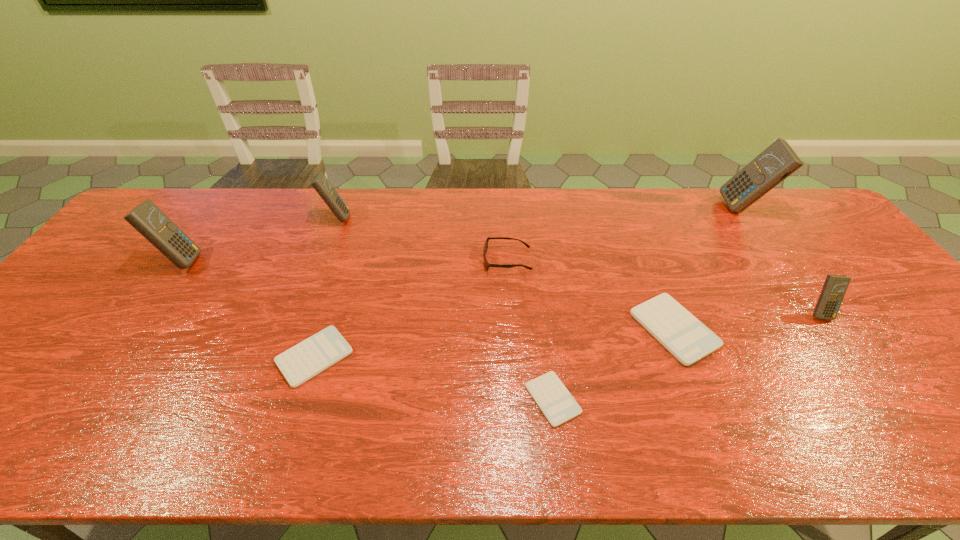
Where is `the rightmost white calculator`? The width and height of the screenshot is (960, 540). the rightmost white calculator is located at coordinates (682, 334).

You are a GUI agent. You are given a task and a screenshot of the screen. Output one action in this format:
    pyautogui.click(x=<x>, y=<y>)
    Task: Click on the second biggest white calculator
    The image size is (960, 540).
    Given the screenshot: What is the action you would take?
    pyautogui.click(x=310, y=357)

Identify the location of the second shortest calculator. Image resolution: width=960 pixels, height=540 pixels. (310, 357).

You are a GUI agent. You are given a task and a screenshot of the screen. Output one action in this format:
    pyautogui.click(x=<x>, y=<y>)
    Task: Click on the smallest white calculator
    This screenshot has height=540, width=960.
    Given the screenshot: What is the action you would take?
    557,404

What are the coordinates of `the shortest calculator` in the screenshot? It's located at (557, 404).

Where is `free spot located 0.350m on the front-facing side of the biggest blue calculator`? free spot located 0.350m on the front-facing side of the biggest blue calculator is located at coordinates (617, 208).

Identify the location of vacant position located on the front-facing side of the biggest blue calculator. (665, 208).

Image resolution: width=960 pixels, height=540 pixels. Identify the location of vacant space located 0.210m on the front-facing side of the biggest blue calculator. (660, 208).

Identify the location of vacant space situated 0.240m on the front-facing side of the second biggest blue calculator. This screenshot has width=960, height=540. (283, 261).

At what (x,y) coordinates should I click in order to perform the action: click on vacant area located on the front-facing side of the sixth shortest object. Please return your answer as a coordinate pair (x, y). Image resolution: width=960 pixels, height=540 pixels. Looking at the image, I should click on (474, 218).